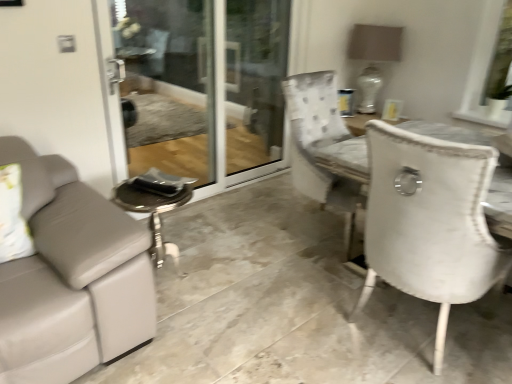
Question: Is white fabric window screen at upper right at the back of transparent glass screen door at center?

Choices:
 (A) yes
 (B) no

Answer: (B)

Question: Are transparent glass screen door at center and white fabric window screen at upper right located far from each other?

Choices:
 (A) no
 (B) yes

Answer: (B)

Question: Could white fabric window screen at upper right be considered to be inside transparent glass screen door at center?

Choices:
 (A) no
 (B) yes

Answer: (A)

Question: Is transparent glass screen door at center wider than white fabric window screen at upper right?

Choices:
 (A) yes
 (B) no

Answer: (B)

Question: Is transparent glass screen door at center positioned beyond the bounds of white fabric window screen at upper right?

Choices:
 (A) no
 (B) yes

Answer: (B)

Question: Which is correct: white fabric window screen at upper right is inside white ceramic lamp at upper right, or outside of it?

Choices:
 (A) outside
 (B) inside

Answer: (A)

Question: Based on their sizes in the image, would you say white fabric window screen at upper right is bigger or smaller than white ceramic lamp at upper right?

Choices:
 (A) small
 (B) big

Answer: (A)

Question: Is white fabric window screen at upper right to the left or to the right of white ceramic lamp at upper right in the image?

Choices:
 (A) right
 (B) left

Answer: (A)

Question: Is point (502, 34) closer or farther from the camera than point (390, 48)?

Choices:
 (A) closer
 (B) farther

Answer: (A)

Question: Relative to white ceramic lamp at upper right, is transparent glass screen door at center in front or behind?

Choices:
 (A) behind
 (B) front

Answer: (B)

Question: Considering the positions of point (280, 122) and point (356, 51), is point (280, 122) closer or farther from the camera than point (356, 51)?

Choices:
 (A) farther
 (B) closer

Answer: (A)

Question: Looking at their shapes, would you say transparent glass screen door at center is wider or thinner than white ceramic lamp at upper right?

Choices:
 (A) wide
 (B) thin

Answer: (B)

Question: Would you say transparent glass screen door at center is to the left or to the right of white ceramic lamp at upper right in the picture?

Choices:
 (A) left
 (B) right

Answer: (A)

Question: From the image's perspective, is white ceramic lamp at upper right positioned above or below transparent glass screen door at center?

Choices:
 (A) below
 (B) above

Answer: (B)

Question: Based on their sizes in the image, would you say white ceramic lamp at upper right is bigger or smaller than transparent glass screen door at center?

Choices:
 (A) big
 (B) small

Answer: (B)